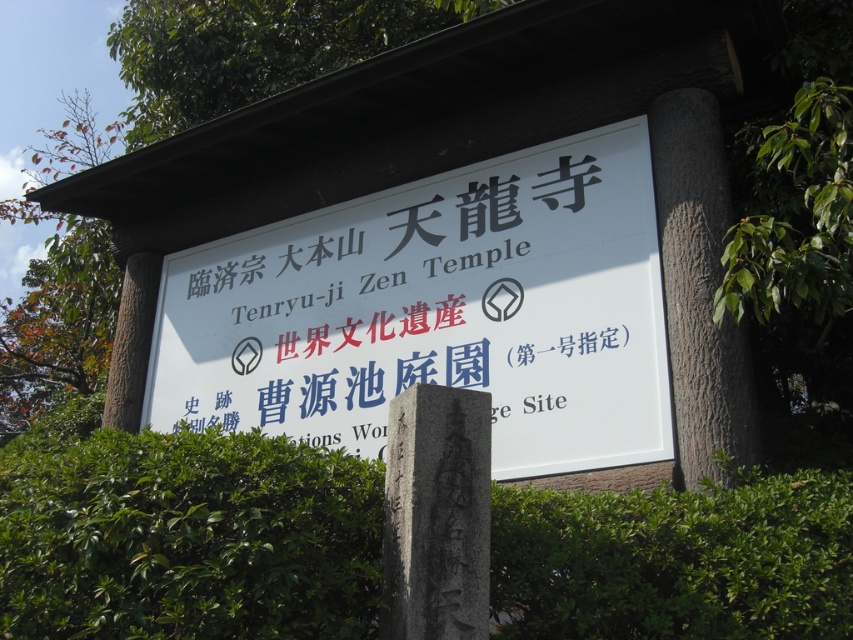
Is white paper sign at center positioned at the back of green leafy tree at upper center?

No, it is in front of green leafy tree at upper center.

This screenshot has width=853, height=640. In order to click on white paper sign at center in this screenshot , I will do `click(438, 310)`.

The width and height of the screenshot is (853, 640). What do you see at coordinates (183, 534) in the screenshot?
I see `green leafy hedge at center` at bounding box center [183, 534].

Which is above, green leafy hedge at center or white paper sign at center?

white paper sign at center is above.

Locate an element on the screen. green leafy hedge at center is located at coordinates (183, 534).

The image size is (853, 640). Find the location of `green leafy hedge at center`. green leafy hedge at center is located at coordinates (183, 534).

Which is below, green leafy hedge at center or green leafy tree at upper center?

green leafy hedge at center is below.

Find the location of a particular element. This screenshot has height=640, width=853. green leafy hedge at center is located at coordinates (183, 534).